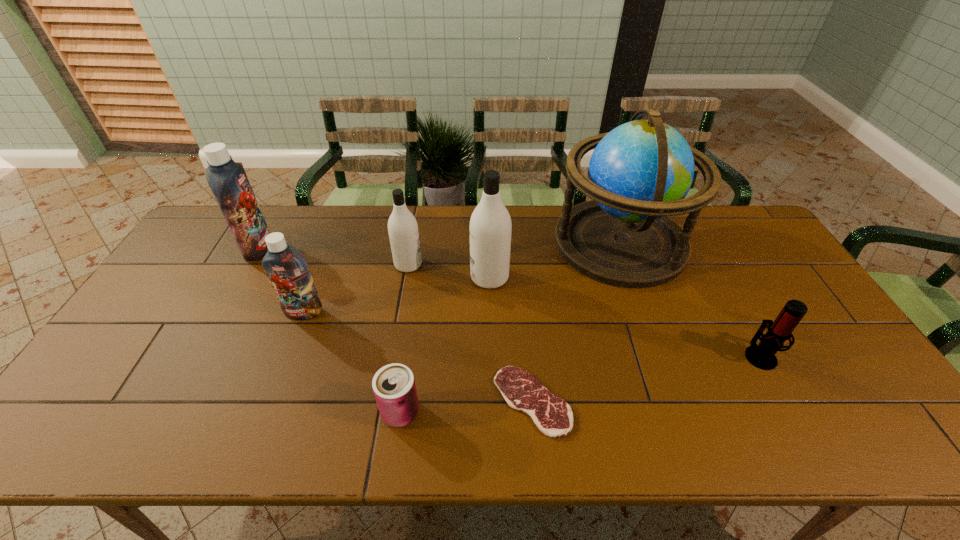
Find the location of a particular element. The width and height of the screenshot is (960, 540). the tallest object is located at coordinates (639, 173).

You are a GUI agent. You are given a task and a screenshot of the screen. Output one action in this format:
    pyautogui.click(x=<x>, y=<y>)
    Task: Click on the leftmost object
    
    Given the screenshot: What is the action you would take?
    pyautogui.click(x=228, y=181)

I want to click on the leftmost shampoo, so click(228, 181).

Locate an element on the screen. Image resolution: width=960 pixels, height=540 pixels. the bigger white shampoo is located at coordinates (490, 226).

Find the location of a particular element. Image resolution: width=960 pixels, height=540 pixels. the rightmost shampoo is located at coordinates (490, 226).

This screenshot has width=960, height=540. I want to click on the smaller white shampoo, so click(x=403, y=231).

The height and width of the screenshot is (540, 960). I want to click on the left white shampoo, so click(403, 231).

In order to click on the right blue shampoo in this screenshot , I will do pyautogui.click(x=288, y=273).

You are a GUI agent. You are given a task and a screenshot of the screen. Output one action in this format:
    pyautogui.click(x=<x>, y=<y>)
    Task: Click on the nearest shampoo
    
    Given the screenshot: What is the action you would take?
    pyautogui.click(x=288, y=273)

Locate an element on the screen. microphone is located at coordinates (762, 356).